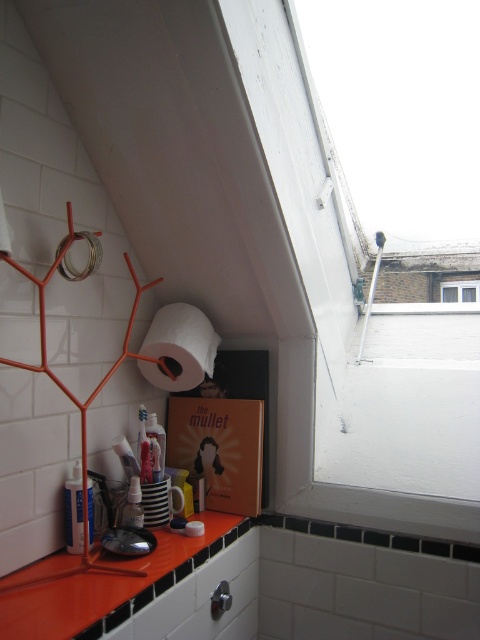
This screenshot has height=640, width=480. What are the coordinates of `orange glossy countertop at lower center` in the screenshot? It's located at (x=111, y=588).

Describe the element at coordinates (111, 588) in the screenshot. The image size is (480, 640). I see `orange glossy countertop at lower center` at that location.

Identify the location of orange glossy countertop at lower center. (111, 588).

Does point (72, 480) lie in front of point (126, 500)?

Yes, point (72, 480) is in front of point (126, 500).

Does translucent plastic tube at lower left have a greater height compared to translucent plastic bottle at lower left?

Yes, translucent plastic tube at lower left is taller than translucent plastic bottle at lower left.

Is point (93, 522) farther from camera compared to point (136, 490)?

That is False.

Locate an element on the screen. The width and height of the screenshot is (480, 640). translucent plastic tube at lower left is located at coordinates (73, 509).

Can you confirm if orange glossy countertop at lower center is wider than transparent glass window at upper right?

Yes, orange glossy countertop at lower center is wider than transparent glass window at upper right.

Between orange glossy countertop at lower center and transparent glass window at upper right, which one has less height?

With less height is orange glossy countertop at lower center.

The height and width of the screenshot is (640, 480). Describe the element at coordinates (111, 588) in the screenshot. I see `orange glossy countertop at lower center` at that location.

Identify the location of orange glossy countertop at lower center. (111, 588).